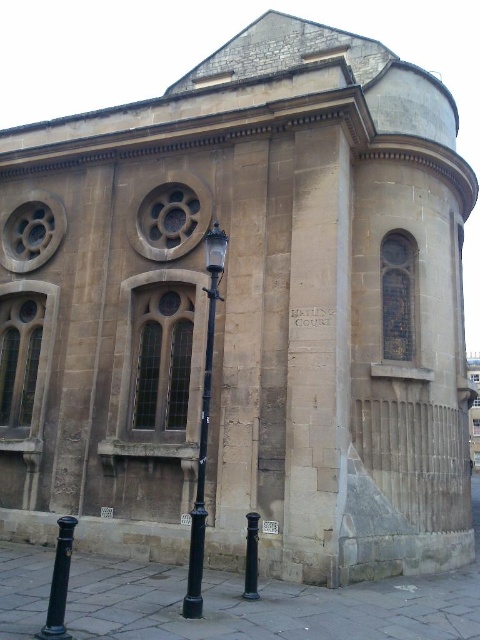
You are standing in front of the historic building and want to determine which of the two points, point (203, 400) or point (57, 604), is closer to you. Based on the image, which point is nearer?

Point (203, 400) is closer to you than point (57, 604) because it is further to the viewer in the image.

You are a maintenance worker needing to replace a broken light bulb in the black metal streetlight at center. You have a ladder that is 20 feet long. The black metal pole at lower left has a hook that can hold the ladder. Can you safely reach the streetlight using the ladder and the pole?

The distance between the black metal streetlight at center and the black metal pole at lower left is 24.12 feet. Since the ladder is only 20 feet long, it is not long enough to safely reach the streetlight from the pole. You would need a longer ladder to bridge this distance.